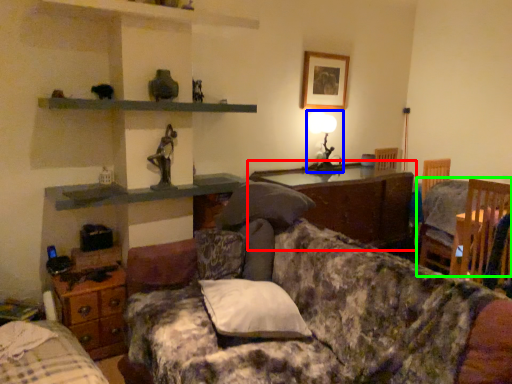
Question: Which object is positioned farthest from cabinetry (highlighted by a red box)? Select from table lamp (highlighted by a blue box) and chair (highlighted by a green box).

Choices:
 (A) table lamp
 (B) chair

Answer: (B)